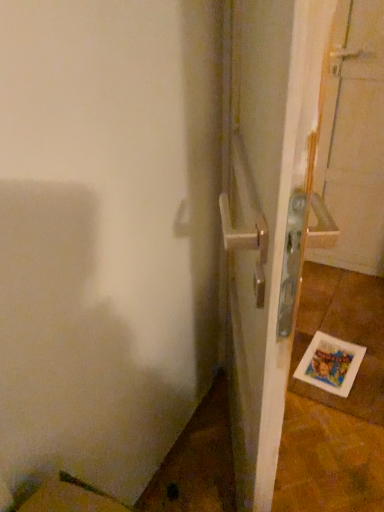
The height and width of the screenshot is (512, 384). Find the location of `white glossy door at center`. white glossy door at center is located at coordinates (266, 213).

What do you see at coordinates (266, 213) in the screenshot? Image resolution: width=384 pixels, height=512 pixels. I see `white glossy door at center` at bounding box center [266, 213].

Where is `white glossy door at center`? white glossy door at center is located at coordinates (266, 213).